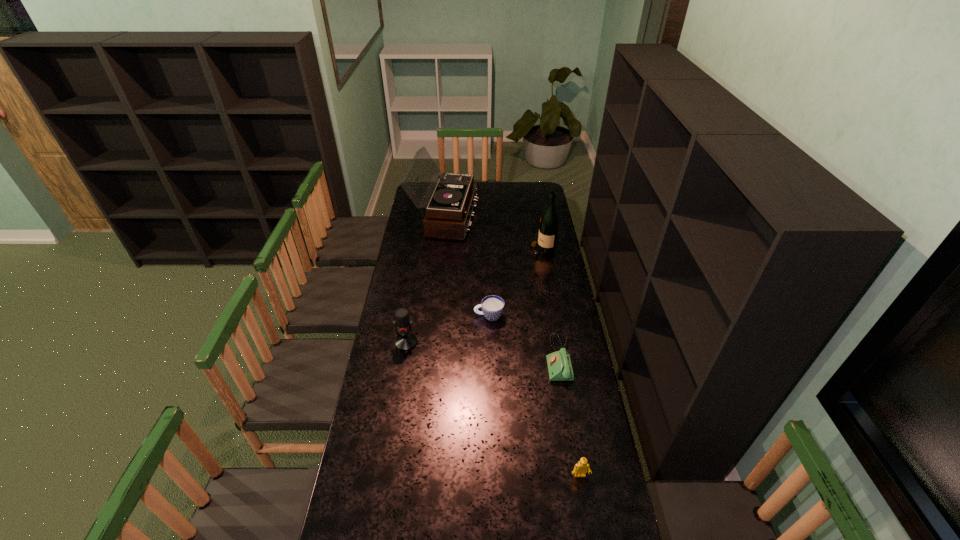
I want to click on the second closest object relative to the fourth shortest object, so click(x=559, y=365).

At what (x,y) coordinates should I click in order to perform the action: click on object that is the second closest one to the cup. Please return your answer as a coordinate pair (x, y). This screenshot has height=540, width=960. Looking at the image, I should click on (405, 341).

This screenshot has width=960, height=540. Identify the location of free spot that satisfies the following two spatial constraints: 1. on the side of the third farthest object with the handle; 2. on the side of the fourth shortest object with the red ring. (490, 342).